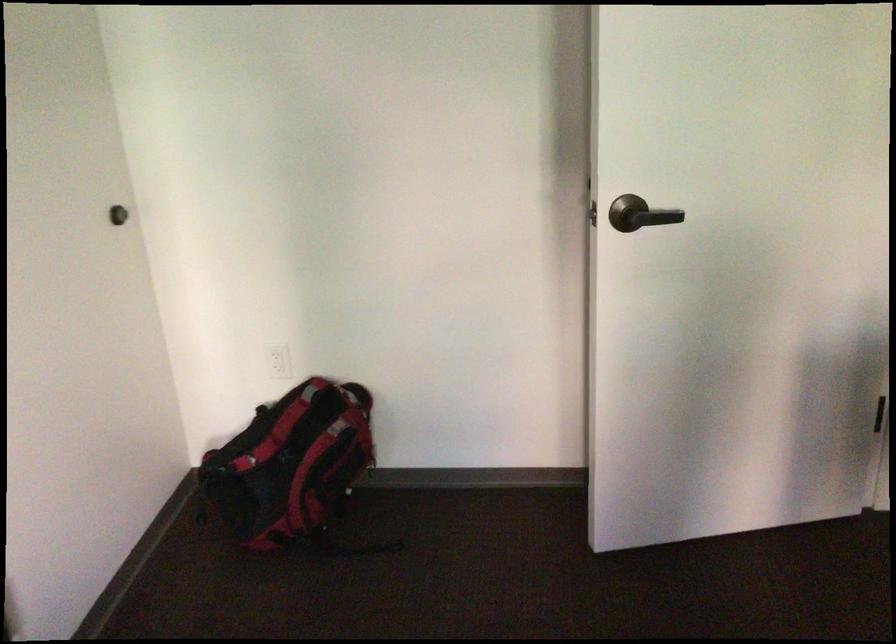
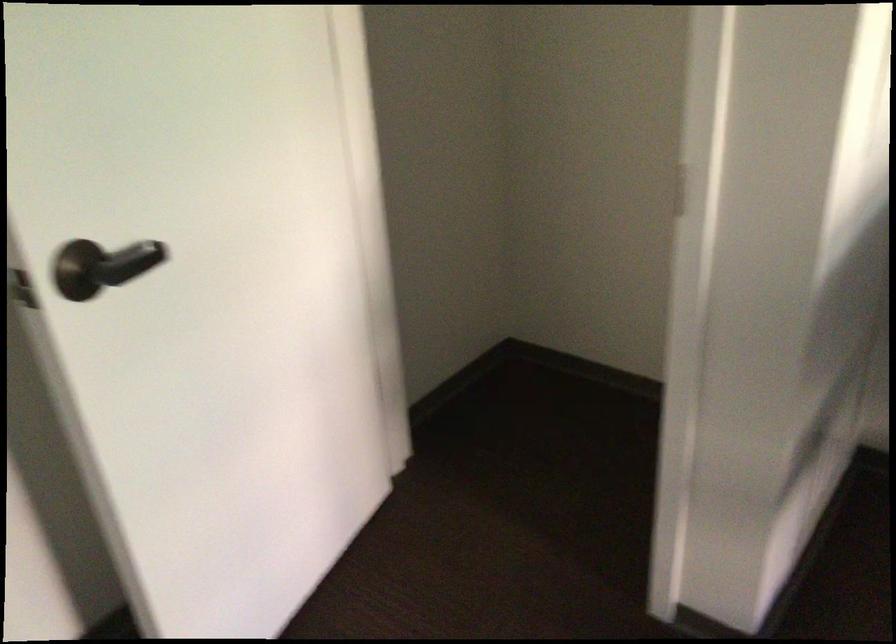
In the second image, find the point that corresponds to (645,211) in the first image.

(107, 265)